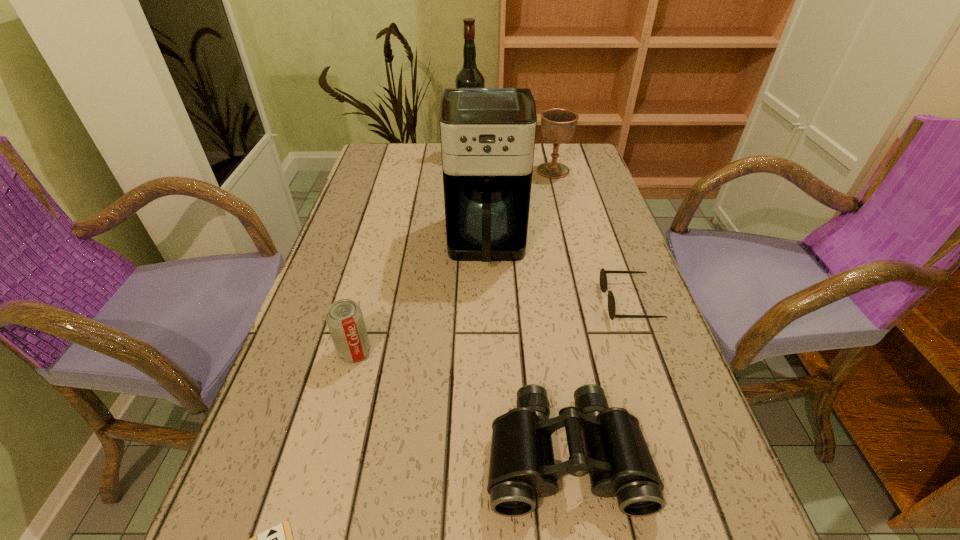
Identify the location of free space between the third nearest object and the third shortest object. The width and height of the screenshot is (960, 540). (460, 403).

Identify the location of free spot between the soda can and the fifth shortest object. (454, 261).

The width and height of the screenshot is (960, 540). I want to click on empty space that is in between the farthest object and the sunglasses, so click(x=550, y=228).

Identify the location of empty space that is in between the fourth farthest object and the binoculars. The width and height of the screenshot is (960, 540). (597, 379).

I want to click on free area in between the sixth farthest object and the fourth nearest object, so click(597, 379).

Find the location of a particular element. This screenshot has width=960, height=540. vacant area between the third shortest object and the chalice is located at coordinates (560, 313).

Locate an element on the screen. This screenshot has height=540, width=960. free space between the third tallest object and the binoculars is located at coordinates tap(560, 313).

The image size is (960, 540). What are the coordinates of `free spot between the second farthest object and the binoculars` in the screenshot? It's located at (560, 313).

Image resolution: width=960 pixels, height=540 pixels. In order to click on object that is the second nearest to the wine bottle in this screenshot , I will do `click(487, 134)`.

Select which object is the closest to the coffee maker. Please provide its 2D coordinates. Your answer should be formatted as a tuple, i.e. [(x, y)], where the tuple contains the x and y coordinates of a point satisfying the conditions above.

[(603, 277)]